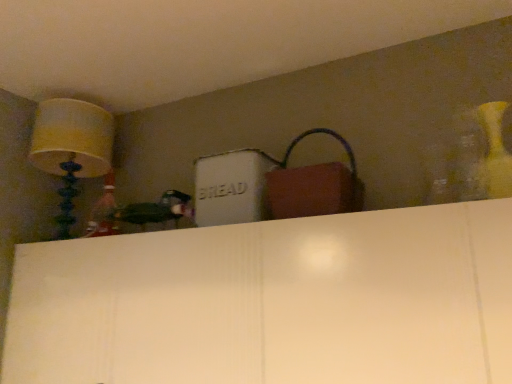
This screenshot has width=512, height=384. What do you see at coordinates (313, 185) in the screenshot? I see `matte brown handbag at upper center` at bounding box center [313, 185].

What are the coordinates of `matte brown handbag at upper center` in the screenshot? It's located at (313, 185).

Describe the element at coordinates (71, 149) in the screenshot. This screenshot has width=512, height=384. I see `matte yellow lampshade at upper left` at that location.

Image resolution: width=512 pixels, height=384 pixels. In order to click on matte yellow lampshade at upper left in this screenshot , I will do `click(71, 149)`.

Locate an element on the screen. matte brown handbag at upper center is located at coordinates (313, 185).

Does matte yellow lampshade at upper left appear on the left side of matte brown handbag at upper center?

Correct, you'll find matte yellow lampshade at upper left to the left of matte brown handbag at upper center.

In the image, is matte yellow lampshade at upper left positioned in front of or behind matte brown handbag at upper center?

Visually, matte yellow lampshade at upper left is located behind matte brown handbag at upper center.

Between point (34, 126) and point (291, 147), which one is positioned in front?

The point (291, 147) is closer.

From the image's perspective, which one is positioned lower, matte yellow lampshade at upper left or matte brown handbag at upper center?

matte brown handbag at upper center.

From a real-world perspective, is matte yellow lampshade at upper left positioned above or below matte brown handbag at upper center?

matte yellow lampshade at upper left is above matte brown handbag at upper center.

Considering the sizes of objects matte yellow lampshade at upper left and matte brown handbag at upper center in the image provided, who is wider, matte yellow lampshade at upper left or matte brown handbag at upper center?

matte yellow lampshade at upper left is wider.

Does matte yellow lampshade at upper left have a lesser height compared to matte brown handbag at upper center?

Incorrect, the height of matte yellow lampshade at upper left does not fall short of that of matte brown handbag at upper center.

Does matte yellow lampshade at upper left have a larger size compared to matte brown handbag at upper center?

Yes, matte yellow lampshade at upper left is bigger than matte brown handbag at upper center.

Based on the photo, does matte yellow lampshade at upper left contain matte brown handbag at upper center?

No, matte brown handbag at upper center is not a part of matte yellow lampshade at upper left.

Is matte yellow lampshade at upper left not near matte brown handbag at upper center?

Absolutely, matte yellow lampshade at upper left is distant from matte brown handbag at upper center.

Is matte yellow lampshade at upper left aimed at matte brown handbag at upper center?

No.

How different are the orientations of matte yellow lampshade at upper left and matte brown handbag at upper center in degrees?

0.406 degrees separate the facing orientations of matte yellow lampshade at upper left and matte brown handbag at upper center.

Locate an element on the screen. The image size is (512, 384). handbag below the matte yellow lampshade at upper left (from a real-world perspective) is located at coordinates (313, 185).

Consider the image. Would you say matte brown handbag at upper center is to the left or to the right of matte yellow lampshade at upper left in the picture?

matte brown handbag at upper center is to the right of matte yellow lampshade at upper left.

Does matte brown handbag at upper center come behind matte yellow lampshade at upper left?

No.

Considering the positions of points (273, 202) and (53, 164), is point (273, 202) closer to camera compared to point (53, 164)?

Yes, it is in front of point (53, 164).

From the image's perspective, is matte brown handbag at upper center under matte yellow lampshade at upper left?

Yes, from the image's perspective, matte brown handbag at upper center is below matte yellow lampshade at upper left.

Looking at this image, from a real-world perspective, is matte brown handbag at upper center positioned above or below matte yellow lampshade at upper left?

matte brown handbag at upper center is below matte yellow lampshade at upper left.

Considering the relative sizes of matte brown handbag at upper center and matte yellow lampshade at upper left in the image provided, is matte brown handbag at upper center wider than matte yellow lampshade at upper left?

No, matte brown handbag at upper center is not wider than matte yellow lampshade at upper left.

Is matte brown handbag at upper center taller than matte yellow lampshade at upper left?

No.

Based on their sizes in the image, would you say matte brown handbag at upper center is bigger or smaller than matte yellow lampshade at upper left?

In the image, matte brown handbag at upper center appears to be smaller than matte yellow lampshade at upper left.

Is matte brown handbag at upper center inside or outside of matte yellow lampshade at upper left?

matte brown handbag at upper center cannot be found inside matte yellow lampshade at upper left.

Is matte brown handbag at upper center far from matte yellow lampshade at upper left?

Yes, matte brown handbag at upper center is far from matte yellow lampshade at upper left.

Is matte brown handbag at upper center facing towards matte yellow lampshade at upper left?

No, matte brown handbag at upper center is not facing towards matte yellow lampshade at upper left.

How far apart are matte brown handbag at upper center and matte yellow lampshade at upper left?

They are 3.50 feet apart.

You are a GUI agent. You are given a task and a screenshot of the screen. Output one action in this format:
    pyautogui.click(x=<x>, y=<y>)
    Task: Click on the lamp to the left of matte brown handbag at upper center
    This screenshot has height=384, width=512.
    Given the screenshot: What is the action you would take?
    tap(71, 149)

Locate an element on the screen. handbag below the matte yellow lampshade at upper left (from the image's perspective) is located at coordinates (313, 185).

Locate an element on the screen. lamp located above the matte brown handbag at upper center (from the image's perspective) is located at coordinates (71, 149).